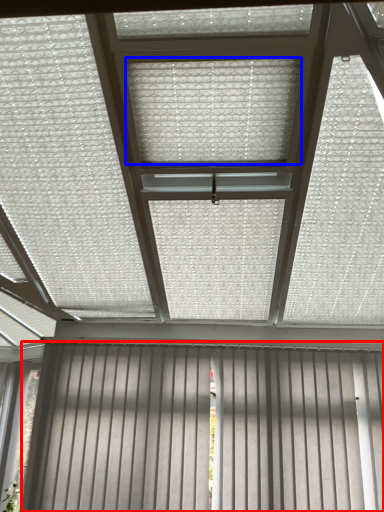
Question: Among these objects, which one is nearest to the camera, garage door (highlighted by a red box) or blind (highlighted by a blue box)?

Choices:
 (A) garage door
 (B) blind

Answer: (B)